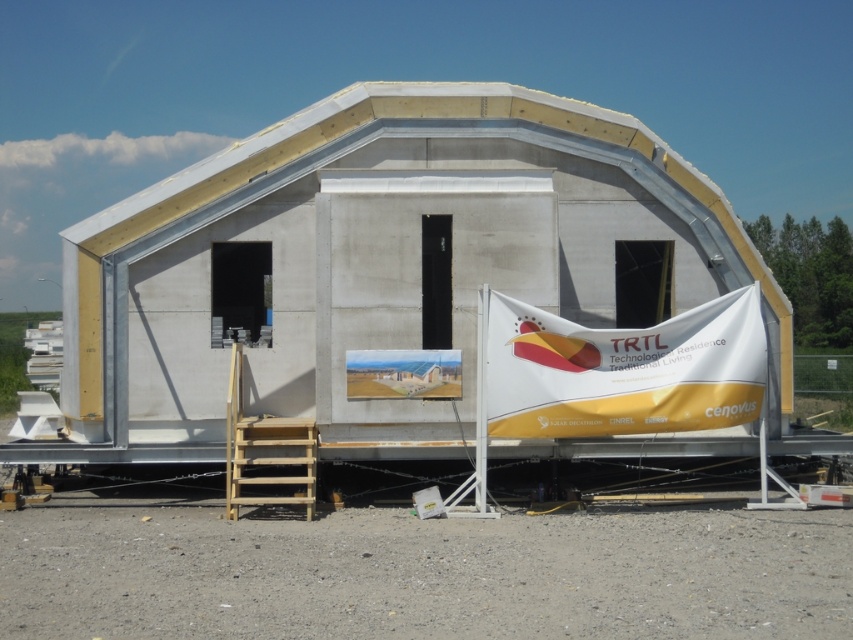
You are standing in front of the prefabricated structure and notice two points marked on its surface. The first point is at coordinate point (x=523, y=260) and the second is at point (x=712, y=324). Which point is closer to your current position?

Point (x=523, y=260) is closer to your current position because it is further to the camera than point (x=712, y=324).